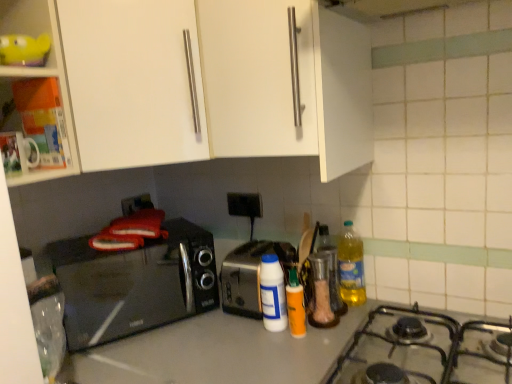
I want to click on vacant area that is in front of yellow translucent bottle at right, so click(340, 324).